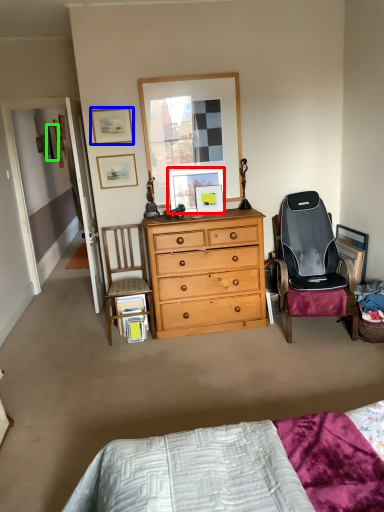
Question: Which object is positioned closest to picture frame (highlighted by a red box)? Select from picture frame (highlighted by a blue box) and picture frame (highlighted by a green box).

Choices:
 (A) picture frame
 (B) picture frame

Answer: (A)